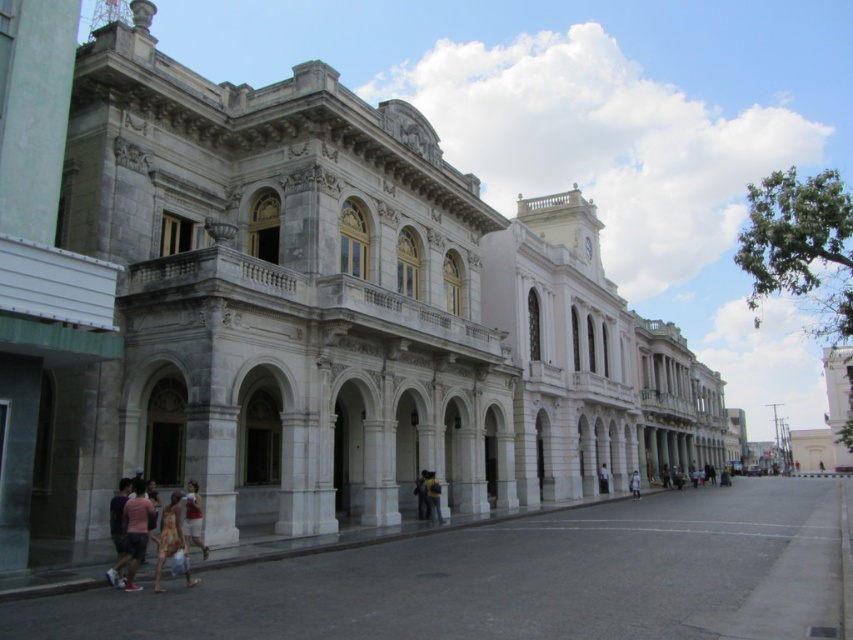
Question: Considering the real-world distances, which object is closest to the gray concrete plaza at center?

Choices:
 (A) light blue denim jeans at center
 (B) gray stone building at center

Answer: (B)

Question: Does gray concrete plaza at center appear under matte white shirt at center?

Choices:
 (A) no
 (B) yes

Answer: (B)

Question: Does printed cotton dress at center have a smaller size compared to light blue denim jeans at center?

Choices:
 (A) no
 (B) yes

Answer: (B)

Question: Which point is farther to the camera?

Choices:
 (A) (244, 580)
 (B) (430, 506)
 (C) (604, 484)

Answer: (C)

Question: Does yellow fabric at center have a smaller size compared to light brown leather jacket at center?

Choices:
 (A) yes
 (B) no

Answer: (B)

Question: Based on their relative distances, which object is nearer to the light blue denim jeans at center?

Choices:
 (A) white cotton shirt at center
 (B) gray concrete plaza at center
 (C) gray stone building at center

Answer: (A)